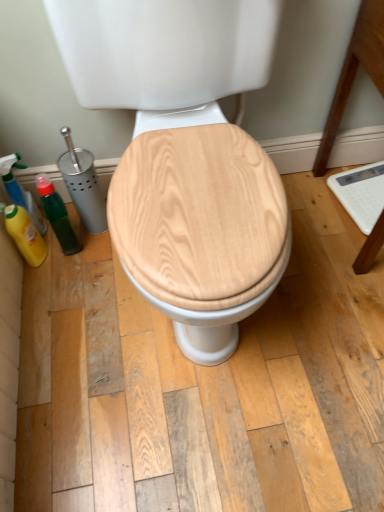
This screenshot has width=384, height=512. I want to click on vacant area that is situated to the right of green matte bottle at left, so click(104, 250).